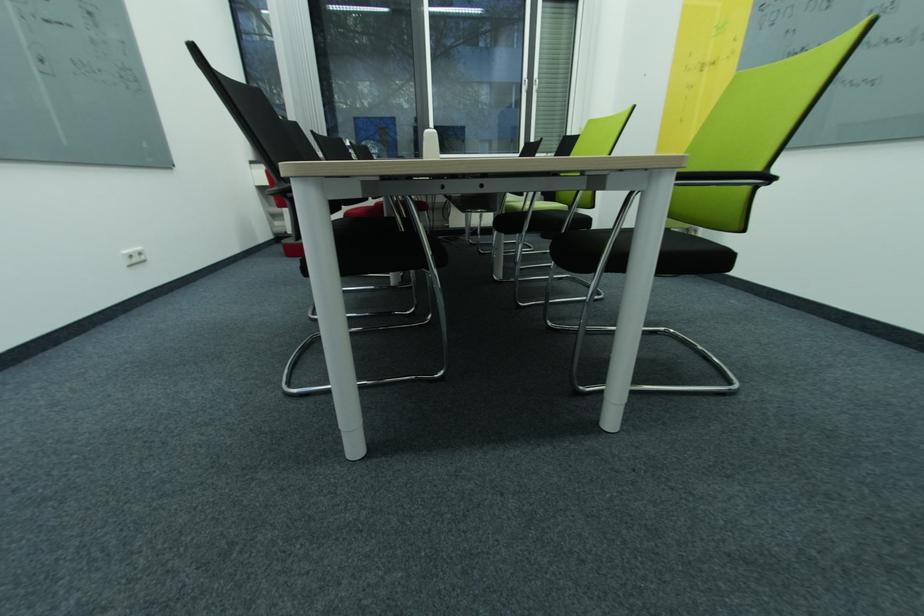
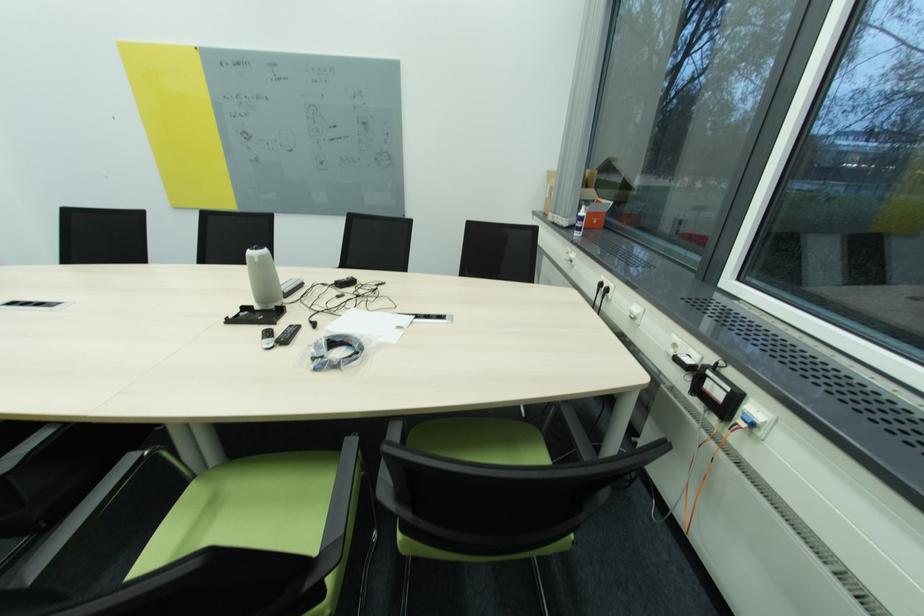
Where in the second image is the point corresponding to (257,158) from the first image?

(544, 209)